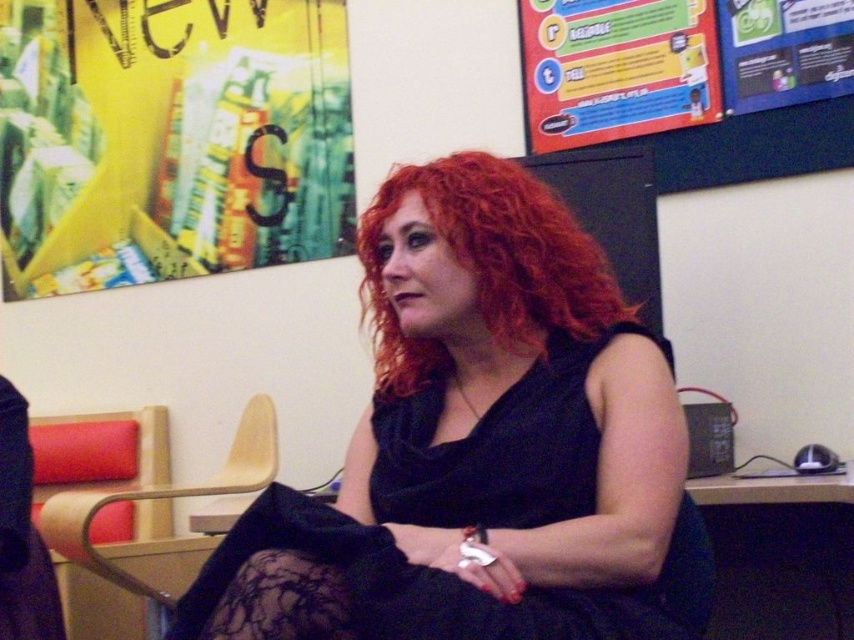
You are a delivery person who needs to place a small package on the floor near the yellow paper poster at upper left without disturbing the person with curly red hair at center. Can you safely place the package there if the minimum safe distance required is 1.5 meters?

The distance between the yellow paper poster at upper left and curly red hair at center is 1.64 meters, which exceeds the 1.5 meters minimum safe distance. Therefore, you can safely place the package near the yellow paper poster at upper left without disturbing the person with curly red hair at center.

You are an interior designer analyzing the image. The black matte dress at center is placed at coordinates 0.697 on the x and 0.564 on the y axis. If the room is 10 meters wide and 8 meters tall, where would the dress be located in meters from the bottom left corner?

The black matte dress at center is located at 6.97 meters from the left and 4.512 meters from the bottom.

In the scene shown: Based on the scene description, which object is taller between the yellow paper poster at upper left and the curly red hair at center?

The yellow paper poster at upper left is taller than the curly red hair at center.